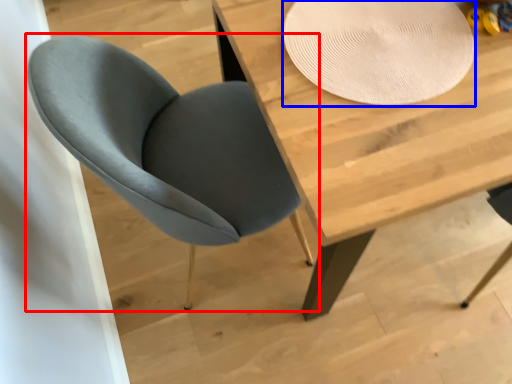
Question: Which object is closer to the camera taking this photo, chair (highlighted by a red box) or paper plate (highlighted by a blue box)?

Choices:
 (A) chair
 (B) paper plate

Answer: (A)